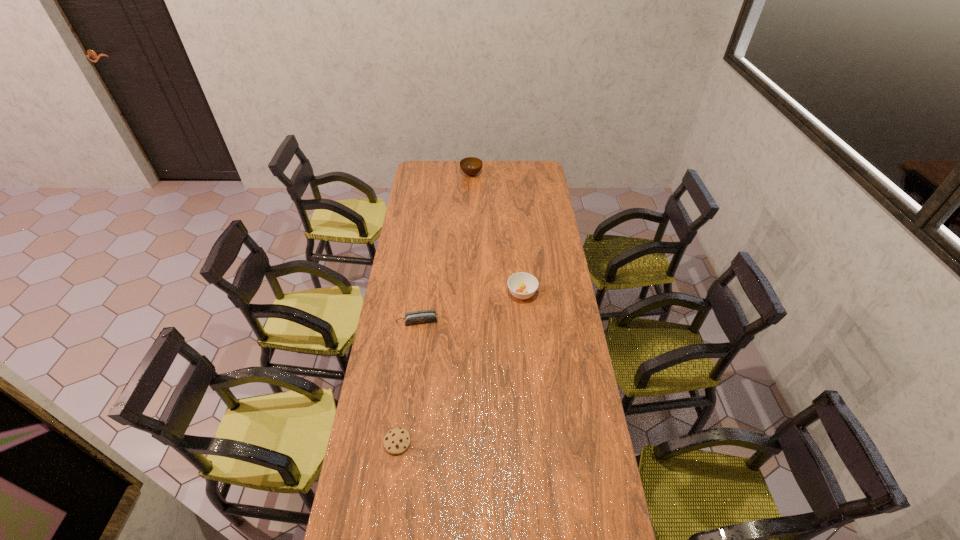
You are a GUI agent. You are given a task and a screenshot of the screen. Output one action in this format:
    pyautogui.click(x=<x>, y=<y>)
    Task: Click on the empty location between the farthest object and the cookie
    The width and height of the screenshot is (960, 540).
    Given the screenshot: What is the action you would take?
    pyautogui.click(x=434, y=308)

Where is `free space between the soup bowl and the pencil box`? This screenshot has width=960, height=540. free space between the soup bowl and the pencil box is located at coordinates (470, 307).

I want to click on free spot between the pencil box and the nearest object, so click(408, 381).

Locate an element on the screen. free spot between the soup bowl and the second nearest object is located at coordinates (470, 307).

At what (x,y) coordinates should I click in order to perform the action: click on free space between the rightmost object and the third tallest object. Please return your answer as a coordinate pair (x, y). This screenshot has height=540, width=960. Looking at the image, I should click on (470, 307).

Point out which object is positioned as the third nearest to the second object from right to left. Please provide its 2D coordinates. Your answer should be formatted as a tuple, i.e. [(x, y)], where the tuple contains the x and y coordinates of a point satisfying the conditions above.

[(396, 441)]

You are a GUI agent. You are given a task and a screenshot of the screen. Output one action in this format:
    pyautogui.click(x=<x>, y=<y>)
    Task: Click on the object that is the closest to the third object from left to right
    The width and height of the screenshot is (960, 540).
    Given the screenshot: What is the action you would take?
    pyautogui.click(x=522, y=285)

Identify the location of free space in the image that satisfies the following two spatial constraints: 1. on the back side of the rightmost object; 2. on the left side of the nearest object. (418, 293).

This screenshot has width=960, height=540. I want to click on free location that satisfies the following two spatial constraints: 1. on the back side of the third farthest object; 2. on the right side of the second object from right to left, so click(437, 174).

The width and height of the screenshot is (960, 540). What are the coordinates of `vacant space that satisfies the following two spatial constraints: 1. on the back side of the second farthest object; 2. on the right side of the third farthest object` in the screenshot? It's located at (421, 293).